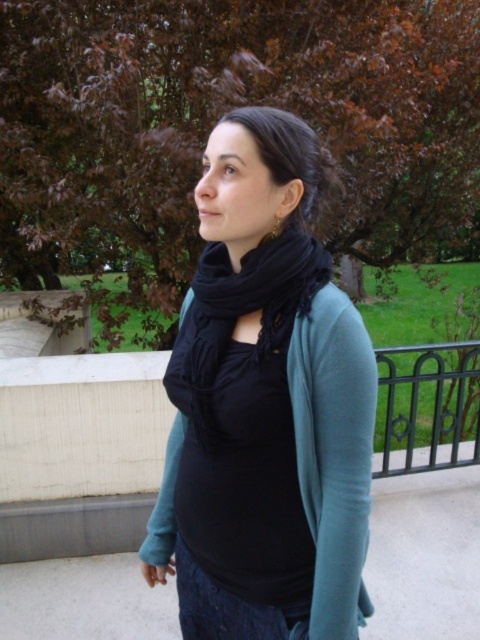
Question: Does black matte scarf at center appear on the left side of denim at lower center?

Choices:
 (A) yes
 (B) no

Answer: (A)

Question: Among these points, which one is farthest from the camera?

Choices:
 (A) (265, 262)
 (B) (274, 70)
 (C) (315, 340)

Answer: (B)

Question: Which object is closer to the camera taking this photo?

Choices:
 (A) black soft scarf at center
 (B) black matte scarf at center
 (C) denim at lower center
 (D) brown leafy tree at upper center

Answer: (B)

Question: Which point is farther to the camera?

Choices:
 (A) brown leafy tree at upper center
 (B) denim at lower center
 (C) black soft scarf at center
 (D) black matte scarf at center

Answer: (A)

Question: Can you confirm if brown leafy tree at upper center is bigger than denim at lower center?

Choices:
 (A) no
 (B) yes

Answer: (B)

Question: Can you confirm if brown leafy tree at upper center is positioned below denim at lower center?

Choices:
 (A) yes
 (B) no

Answer: (B)